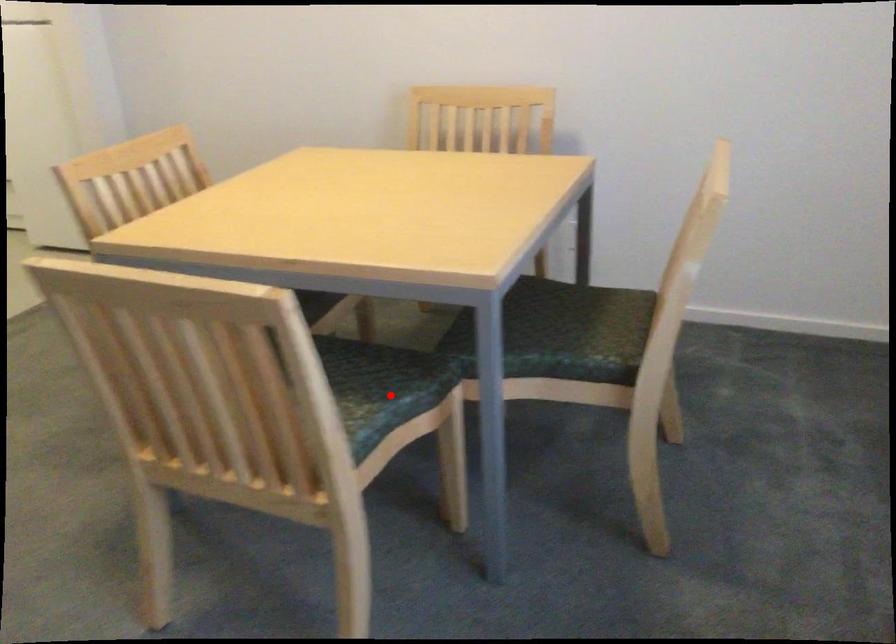
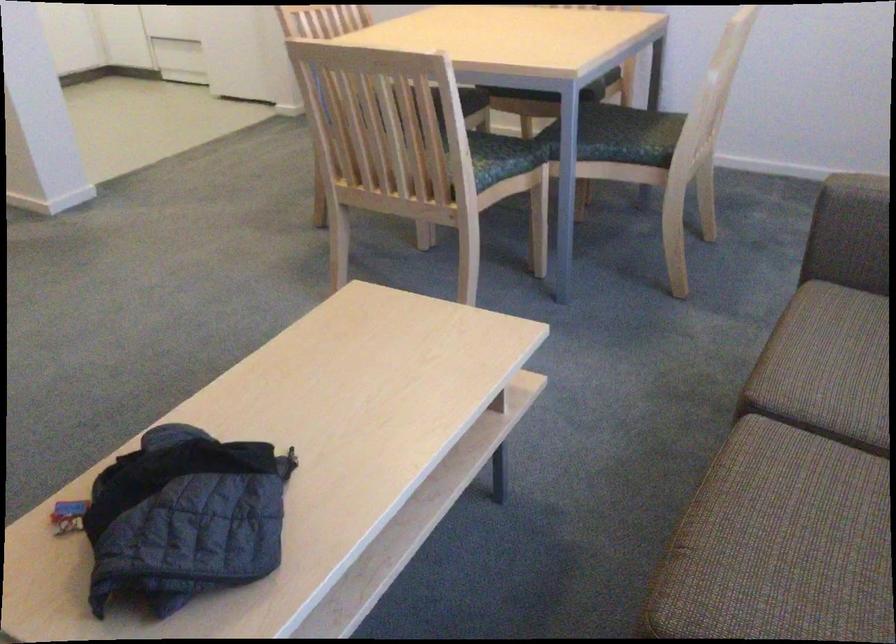
Locate, in the second image, the point that corresponds to the highlighted location in the first image.

(501, 158)